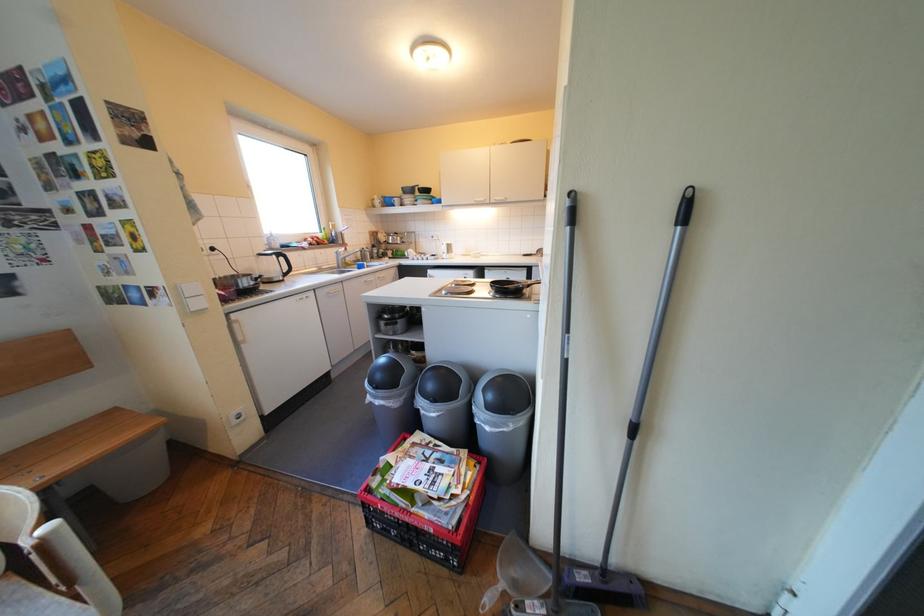
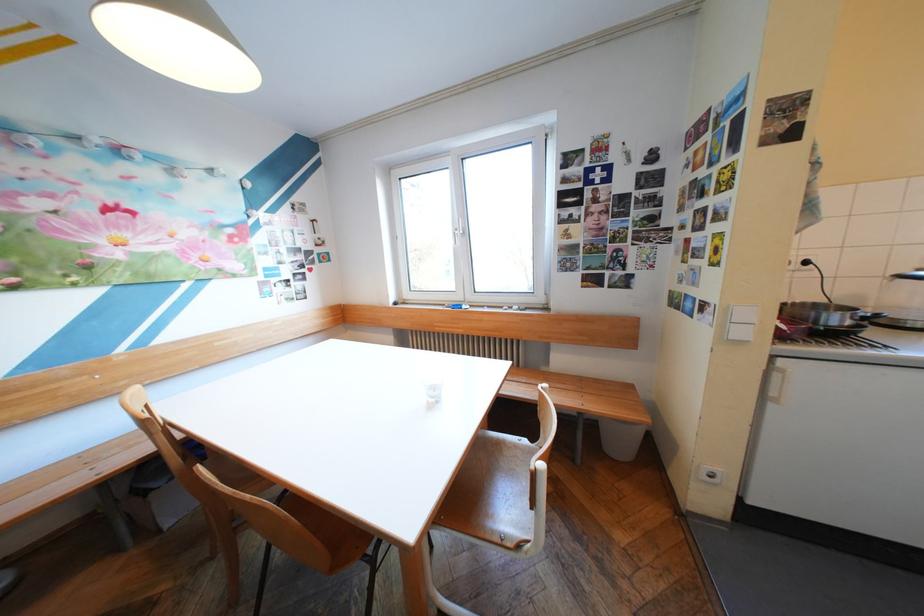
In the second image, find the point that corresponds to (250,424) in the first image.

(719, 482)